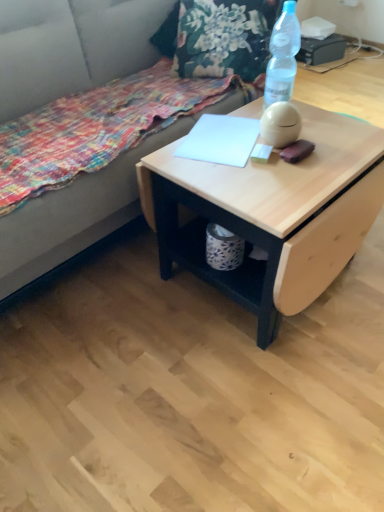
You are a GUI agent. You are given a task and a screenshot of the screen. Output one action in this format:
    pyautogui.click(x=<x>, y=<y>)
    Task: Click on the vacant area that is situated to the right of white paper at center
    The image size is (384, 512).
    Given the screenshot: What is the action you would take?
    pyautogui.click(x=317, y=145)